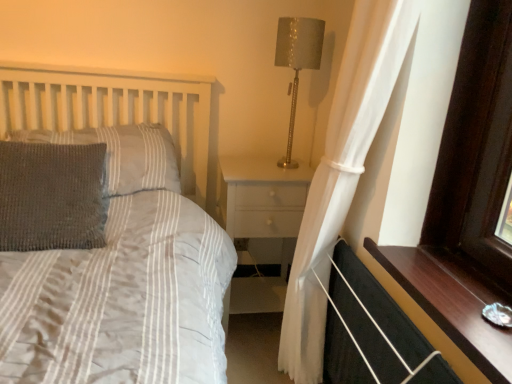
This screenshot has height=384, width=512. What are the coordinates of `gray knitted pillow at left, acting as the first pillow starting from the front` in the screenshot? It's located at (51, 196).

In order to face woolen gray pillow at left, positioned as the first pillow in back-to-front order, should I rotate leftwards or rightwards?

To align with it, rotate left about 21.336°.

You are a GUI agent. You are given a task and a screenshot of the screen. Output one action in this format:
    pyautogui.click(x=<x>, y=<y>)
    Task: Click on the white wood nightstand at center
    The width and height of the screenshot is (512, 384).
    Given the screenshot: What is the action you would take?
    pyautogui.click(x=261, y=197)

What is the approximate height of white sheer curtain at right?

white sheer curtain at right is 1.43 meters tall.

What do you see at coordinates (373, 332) in the screenshot?
I see `black fabric balustrade at lower right` at bounding box center [373, 332].

The height and width of the screenshot is (384, 512). I want to click on gray knitted pillow at left, acting as the first pillow starting from the front, so click(51, 196).

Based on the photo, considering their positions, is dark wood window sill at lower right located in front of or behind black fabric balustrade at lower right?

dark wood window sill at lower right is positioned closer to the viewer than black fabric balustrade at lower right.

Is the surface of dark wood window sill at lower right in direct contact with black fabric balustrade at lower right?

No, dark wood window sill at lower right is not next to black fabric balustrade at lower right.

Could you tell me if dark wood window sill at lower right is turned towards black fabric balustrade at lower right?

No, dark wood window sill at lower right is not turned towards black fabric balustrade at lower right.

From a real-world perspective, which object rests below the other?

black fabric balustrade at lower right is physically lower.

Which object is further away from the camera taking this photo, gray knitted pillow at left, acting as the first pillow starting from the front, or woolen gray pillow at left, positioned as the first pillow in back-to-front order?

woolen gray pillow at left, positioned as the first pillow in back-to-front order, is further from the camera.

In terms of width, does gray knitted pillow at left, acting as the first pillow starting from the front, look wider or thinner when compared to woolen gray pillow at left, positioned as the first pillow in back-to-front order?

Clearly, gray knitted pillow at left, acting as the first pillow starting from the front, has less width compared to woolen gray pillow at left, positioned as the first pillow in back-to-front order.

Is gray knitted pillow at left, marked as the 2th pillow in a back-to-front arrangement, beside woolen gray pillow at left, positioned as the first pillow in back-to-front order?

No.

Does gray knitted pillow at left, acting as the first pillow starting from the front, contain woolen gray pillow at left, positioned as the first pillow in back-to-front order?

No, gray knitted pillow at left, acting as the first pillow starting from the front, does not contain woolen gray pillow at left, positioned as the first pillow in back-to-front order.

From a real-world perspective, is gray knitted pillow at left, acting as the first pillow starting from the front, physically below dark wood window sill at lower right?

No, from a real-world perspective, gray knitted pillow at left, acting as the first pillow starting from the front, is not under dark wood window sill at lower right.

Which point is more forward, (10, 241) or (485, 338)?

Point (485, 338)

Consider the image. Are gray knitted pillow at left, acting as the first pillow starting from the front, and dark wood window sill at lower right making contact?

There is a gap between gray knitted pillow at left, acting as the first pillow starting from the front, and dark wood window sill at lower right.

Is gray knitted pillow at left, marked as the 2th pillow in a back-to-front arrangement, in front of or behind dark wood window sill at lower right in the image?

gray knitted pillow at left, marked as the 2th pillow in a back-to-front arrangement, is behind dark wood window sill at lower right.

Between white wood nightstand at center and metallic gold table lamp at upper right, which one appears on the left side from the viewer's perspective?

From the viewer's perspective, white wood nightstand at center appears more on the left side.

Which is in front, white wood nightstand at center or metallic gold table lamp at upper right?

metallic gold table lamp at upper right is in front.

Is white wood nightstand at center facing away from metallic gold table lamp at upper right?

white wood nightstand at center is not turned away from metallic gold table lamp at upper right.

In the scene shown: Which of these two, white wood nightstand at center or metallic gold table lamp at upper right, is bigger?

Bigger between the two is white wood nightstand at center.

Which is further, (x=377, y=96) or (x=76, y=199)?

The point (x=76, y=199) is farther from the camera.

Considering the sizes of objects white sheer curtain at right and gray knitted pillow at left, acting as the first pillow starting from the front, in the image provided, who is shorter, white sheer curtain at right or gray knitted pillow at left, acting as the first pillow starting from the front,?

gray knitted pillow at left, acting as the first pillow starting from the front, is shorter.

Looking at this image, is white sheer curtain at right to the left or to the right of gray knitted pillow at left, marked as the 2th pillow in a back-to-front arrangement, in the image?

white sheer curtain at right is positioned on gray knitted pillow at left, marked as the 2th pillow in a back-to-front arrangement,'s right side.

Is white sheer curtain at right situated inside gray knitted pillow at left, marked as the 2th pillow in a back-to-front arrangement, or outside?

white sheer curtain at right is not inside gray knitted pillow at left, marked as the 2th pillow in a back-to-front arrangement, it's outside.

Is dark wood window sill at lower right completely or partially outside of white sheer curtain at right?

dark wood window sill at lower right lies outside white sheer curtain at right's area.

Can you see dark wood window sill at lower right touching white sheer curtain at right?

No, dark wood window sill at lower right is not beside white sheer curtain at right.

Locate an element on the screen. The width and height of the screenshot is (512, 384). window sill to the right of white sheer curtain at right is located at coordinates (452, 302).

Is metallic gold table lamp at upper right inside gray knitted pillow at left, marked as the 2th pillow in a back-to-front arrangement?

No, metallic gold table lamp at upper right is not inside gray knitted pillow at left, marked as the 2th pillow in a back-to-front arrangement.

Is gray knitted pillow at left, acting as the first pillow starting from the front, touching metallic gold table lamp at upper right?

gray knitted pillow at left, acting as the first pillow starting from the front, is not next to metallic gold table lamp at upper right, and they're not touching.

In terms of size, does gray knitted pillow at left, marked as the 2th pillow in a back-to-front arrangement, appear bigger or smaller than metallic gold table lamp at upper right?

Considering their sizes, gray knitted pillow at left, marked as the 2th pillow in a back-to-front arrangement, takes up more space than metallic gold table lamp at upper right.

From the image's perspective, which is below, gray knitted pillow at left, acting as the first pillow starting from the front, or metallic gold table lamp at upper right?

From the image's view, gray knitted pillow at left, acting as the first pillow starting from the front, is below.

In the image, there is a dark wood window sill at lower right. Where is `balustrade below it (from a real-world perspective)`? The image size is (512, 384). balustrade below it (from a real-world perspective) is located at coordinates (373, 332).

Where is `pillow lying behind the gray knitted pillow at left, acting as the first pillow starting from the front`? This screenshot has width=512, height=384. pillow lying behind the gray knitted pillow at left, acting as the first pillow starting from the front is located at coordinates (123, 154).

Looking at the image, which one is located closer to black fabric balustrade at lower right, metallic gold table lamp at upper right or white wood nightstand at center?

Among the two, white wood nightstand at center is located nearer to black fabric balustrade at lower right.

Which object lies further to the anchor point dark wood window sill at lower right, white sheer curtain at right or gray knitted pillow at left, acting as the first pillow starting from the front?

Based on the image, gray knitted pillow at left, acting as the first pillow starting from the front, appears to be further to dark wood window sill at lower right.

When comparing their distances from white sheer curtain at right, does dark wood window sill at lower right or white wood nightstand at center seem further?

dark wood window sill at lower right lies further to white sheer curtain at right than the other object.

From the picture: Estimate the real-world distances between objects in this image. Which object is closer to white wood nightstand at center, black fabric balustrade at lower right or dark wood window sill at lower right?

Among the two, black fabric balustrade at lower right is located nearer to white wood nightstand at center.

When comparing their distances from black fabric balustrade at lower right, does metallic gold table lamp at upper right or woolen gray pillow at left, acting as the 2th pillow starting from the front, seem closer?

metallic gold table lamp at upper right is closer to black fabric balustrade at lower right.

Looking at the image, which one is located closer to white wood nightstand at center, white sheer curtain at right or gray knitted pillow at left, marked as the 2th pillow in a back-to-front arrangement?

The object closer to white wood nightstand at center is white sheer curtain at right.

Looking at the image, which one is located further to white wood nightstand at center, white sheer curtain at right or dark wood window sill at lower right?

dark wood window sill at lower right lies further to white wood nightstand at center than the other object.

Based on their spatial positions, is gray knitted pillow at left, acting as the first pillow starting from the front, or woolen gray pillow at left, acting as the 2th pillow starting from the front, closer to white sheer curtain at right?

woolen gray pillow at left, acting as the 2th pillow starting from the front.

At what (x,y) coordinates should I click in order to perform the action: click on pillow located between gray knitted pillow at left, acting as the first pillow starting from the front, and black fabric balustrade at lower right in the left-right direction. Please return your answer as a coordinate pair (x, y). Image resolution: width=512 pixels, height=384 pixels. Looking at the image, I should click on (123, 154).

Find the location of `pillow between gray knitted pillow at left, acting as the first pillow starting from the front, and dark wood window sill at lower right`. pillow between gray knitted pillow at left, acting as the first pillow starting from the front, and dark wood window sill at lower right is located at coordinates (123, 154).

Identify the location of balustrade situated between gray knitted pillow at left, marked as the 2th pillow in a back-to-front arrangement, and dark wood window sill at lower right from left to right. This screenshot has width=512, height=384. (373, 332).

Identify the location of nightstand between gray knitted pillow at left, marked as the 2th pillow in a back-to-front arrangement, and metallic gold table lamp at upper right, in the horizontal direction. tap(261, 197).